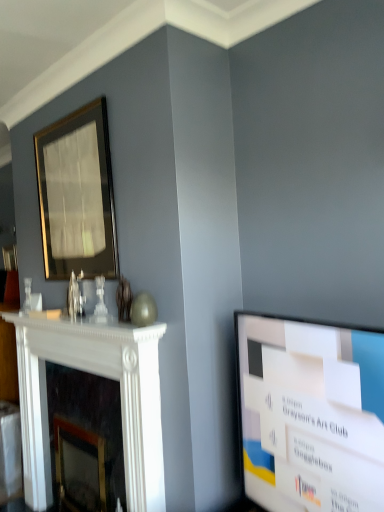
What is the approximate width of white glossy screen at right?

It is 5.73 inches.

What is the approximate width of white marble fireplace at left?

The width of white marble fireplace at left is 3.95 inches.

The width and height of the screenshot is (384, 512). In order to click on white glossy screen at right in this screenshot , I will do `click(311, 414)`.

Between point (44, 189) and point (73, 364), which one is positioned in front?

Positioned in front is point (73, 364).

Based on the photo, from the image's perspective, which one is positioned higher, gold-framed mirror at upper left or white marble fireplace at left?

gold-framed mirror at upper left.

Looking at this image, can we say gold-framed mirror at upper left lies outside white marble fireplace at left?

gold-framed mirror at upper left lies outside white marble fireplace at left's area.

At what (x,y) coordinates should I click in order to perform the action: click on fireplace lying in front of the gold-framed mirror at upper left. Please return your answer as a coordinate pair (x, y). Looking at the image, I should click on (99, 375).

Identify the location of fireplace that is under the white glossy screen at right (from a real-world perspective). (99, 375).

Considering the positions of objects white glossy screen at right and white marble fireplace at left in the image provided, who is behind, white glossy screen at right or white marble fireplace at left?

white marble fireplace at left is further away from the camera.

Between point (371, 483) and point (46, 396), which one is positioned in front?

The point (371, 483) is more forward.

Is white glossy screen at right turned away from white marble fireplace at left?

No.

Is point (35, 489) positioned behind point (79, 241)?

Yes, it is behind point (79, 241).

The width and height of the screenshot is (384, 512). I want to click on picture frame behind the white marble fireplace at left, so click(77, 194).

Is white marble fireplace at left with gold-framed mirror at upper left?

No, white marble fireplace at left is not beside gold-framed mirror at upper left.

Can you confirm if white marble fireplace at left is thinner than white glossy screen at right?

Yes.

Locate an element on the screen. fireplace that is on the left side of white glossy screen at right is located at coordinates (99, 375).

Which of these two, white marble fireplace at left or white glossy screen at right, stands taller?

With more height is white marble fireplace at left.

How many degrees apart are the facing directions of white marble fireplace at left and white glossy screen at right?

10.5 degrees separate the facing orientations of white marble fireplace at left and white glossy screen at right.

Looking at this image, which object is further away from the camera taking this photo, gold-framed mirror at upper left or white glossy screen at right?

gold-framed mirror at upper left is further away from the camera.

Is gold-framed mirror at upper left facing towards white glossy screen at right?

No.

From a real-world perspective, which object rests below the other?

white glossy screen at right.

Between gold-framed mirror at upper left and white glossy screen at right, which one has less height?

white glossy screen at right is shorter.

Is white glossy screen at right aimed at gold-framed mirror at upper left?

No, white glossy screen at right is not facing towards gold-framed mirror at upper left.

Does white glossy screen at right appear on the left side of gold-framed mirror at upper left?

Incorrect, white glossy screen at right is not on the left side of gold-framed mirror at upper left.

How far apart are white glossy screen at right and gold-framed mirror at upper left?

The distance of white glossy screen at right from gold-framed mirror at upper left is 1.11 meters.

From the image's perspective, which object appears higher, white glossy screen at right or gold-framed mirror at upper left?

From the image's view, gold-framed mirror at upper left is above.

The image size is (384, 512). I want to click on picture frame that is on the left side of white marble fireplace at left, so click(77, 194).

What are the coordinates of `fireplace below the white glossy screen at right (from a real-world perspective)` in the screenshot? It's located at pyautogui.click(x=99, y=375).

From the image, which object appears to be nearer to white marble fireplace at left, gold-framed mirror at upper left or white glossy screen at right?

gold-framed mirror at upper left is closer to white marble fireplace at left.

Estimate the real-world distances between objects in this image. Which object is closer to white glossy screen at right, gold-framed mirror at upper left or white marble fireplace at left?

Among the two, white marble fireplace at left is located nearer to white glossy screen at right.

Looking at the image, which one is located closer to gold-framed mirror at upper left, white glossy screen at right or white marble fireplace at left?

The object closer to gold-framed mirror at upper left is white marble fireplace at left.

Looking at the image, which one is located further to white glossy screen at right, white marble fireplace at left or gold-framed mirror at upper left?

gold-framed mirror at upper left.

Estimate the real-world distances between objects in this image. Which object is closer to gold-framed mirror at upper left, white marble fireplace at left or white glossy screen at right?

white marble fireplace at left.

From the image, which object appears to be nearer to white marble fireplace at left, white glossy screen at right or gold-framed mirror at upper left?

gold-framed mirror at upper left lies closer to white marble fireplace at left than the other object.

At what (x,y) coordinates should I click in order to perform the action: click on television between gold-framed mirror at upper left and white marble fireplace at left from top to bottom. Please return your answer as a coordinate pair (x, y). This screenshot has width=384, height=512. Looking at the image, I should click on (311, 414).